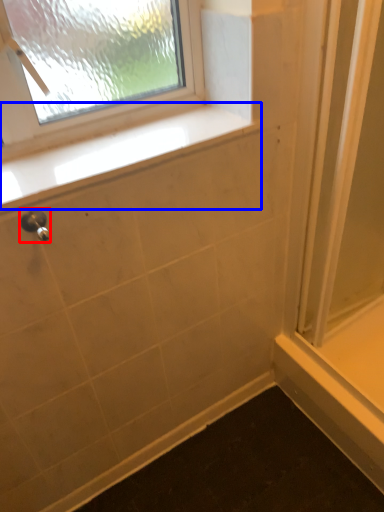
Question: Which of the following is the closest to the observer, shower (highlighted by a red box) or window sill (highlighted by a blue box)?

Choices:
 (A) shower
 (B) window sill

Answer: (A)